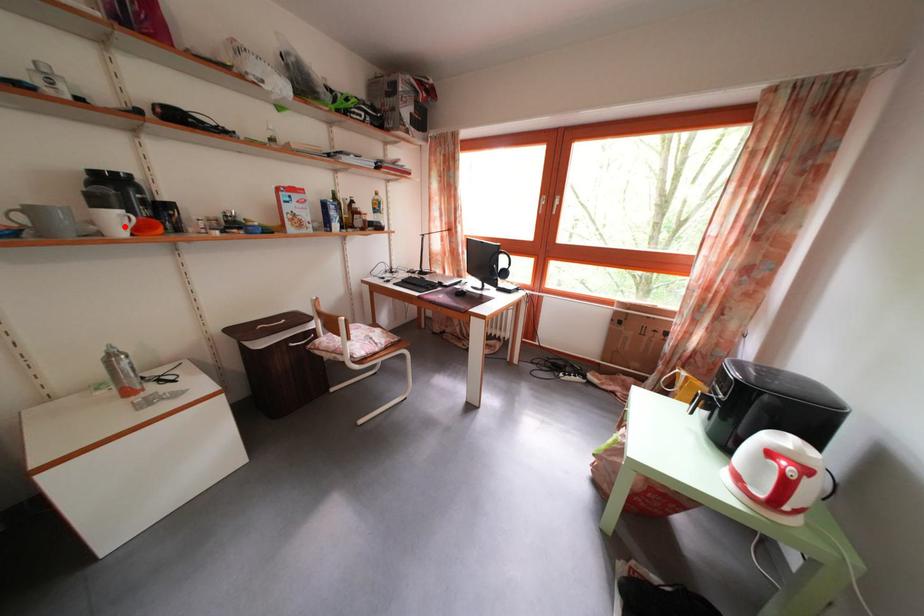
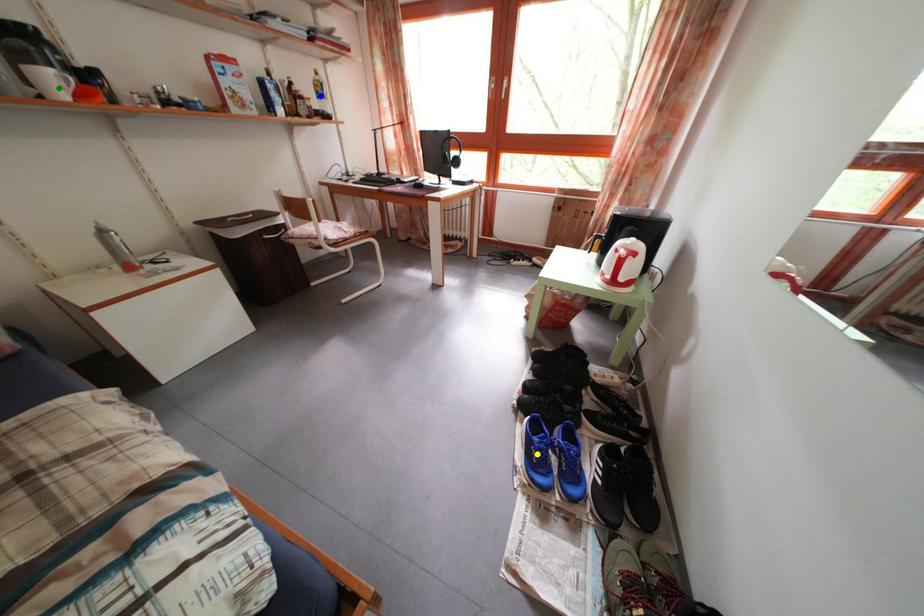
Question: I am providing you with two images of the same scene from different viewpoints. A red point is marked on the first image. You are given multiple points on the second image. Which mark in image 2 goes with the point in image 1?

Choices:
 (A) yellow point
 (B) green point
 (C) blue point

Answer: (B)